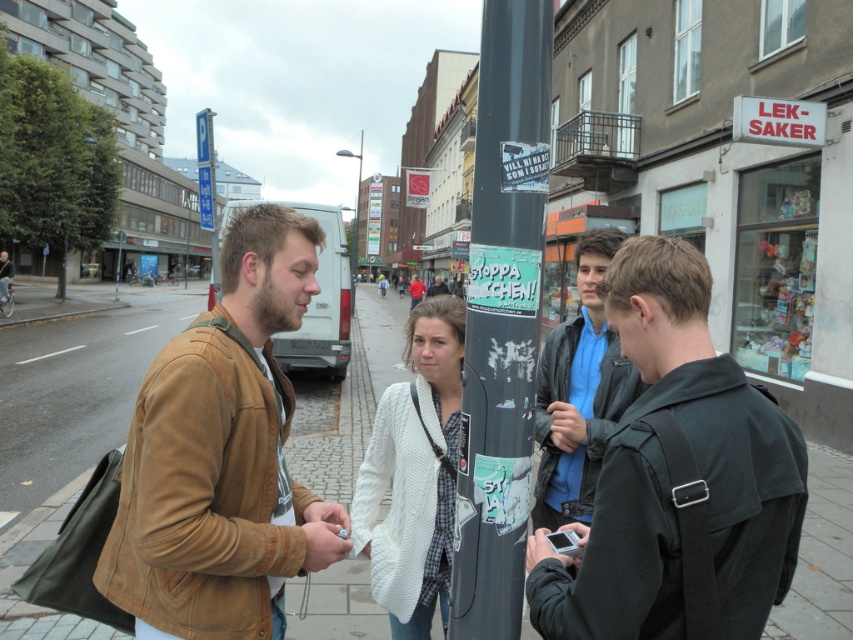
At what (x,y) coordinates should I click in order to perform the action: click on brown suede jacket at left. Please return your answer as a coordinate pair (x, y). The image size is (853, 640). Looking at the image, I should click on (222, 456).

Looking at this image, does brown suede jacket at left have a larger size compared to dark gray pole at center?

Indeed, brown suede jacket at left has a larger size compared to dark gray pole at center.

Does point (270, 481) come in front of point (497, 589)?

No, it is behind (497, 589).

I want to click on brown suede jacket at left, so click(x=222, y=456).

Which of these two, dark blue jacket at center or red cotton shirt at center, stands shorter?

Standing shorter between the two is dark blue jacket at center.

Is dark blue jacket at center closer to camera compared to red cotton shirt at center?

Yes, it is.

Is point (607, 419) behind point (413, 301)?

That is False.

Locate an element on the screen. Image resolution: width=853 pixels, height=640 pixels. dark blue jacket at center is located at coordinates point(579,394).

Is dark gray jacket at center positioned in front of light brown leather jacket at center?

Yes, dark gray jacket at center is closer to the viewer.

Where is `dark gray jacket at center`? The height and width of the screenshot is (640, 853). dark gray jacket at center is located at coordinates (666, 472).